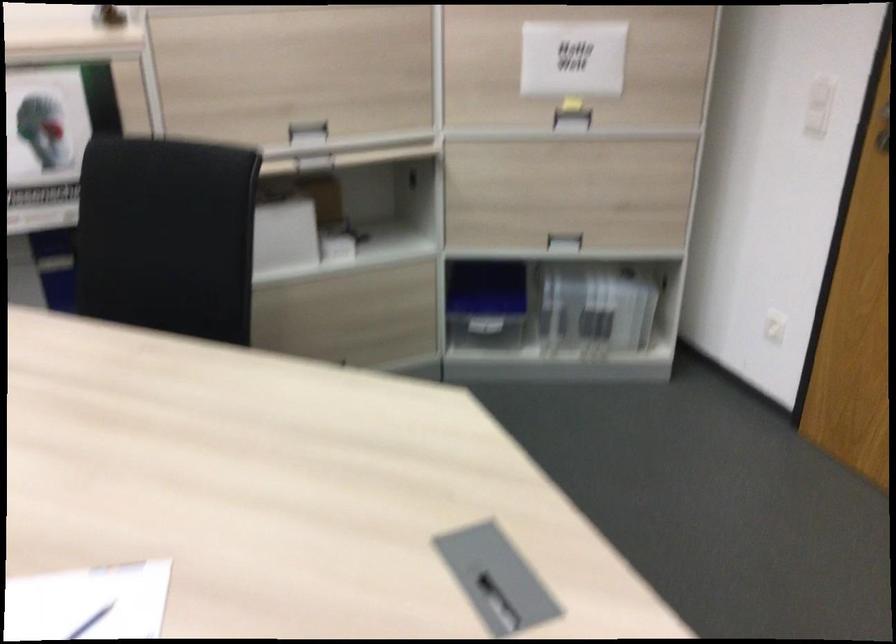
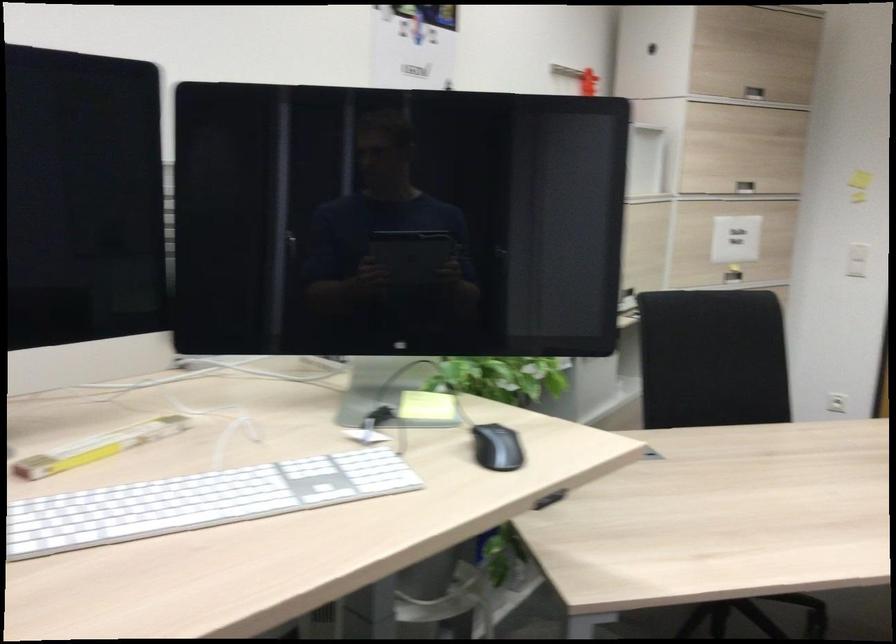
Find the pixel in the second image that matches [159,234] in the first image.

(712, 359)